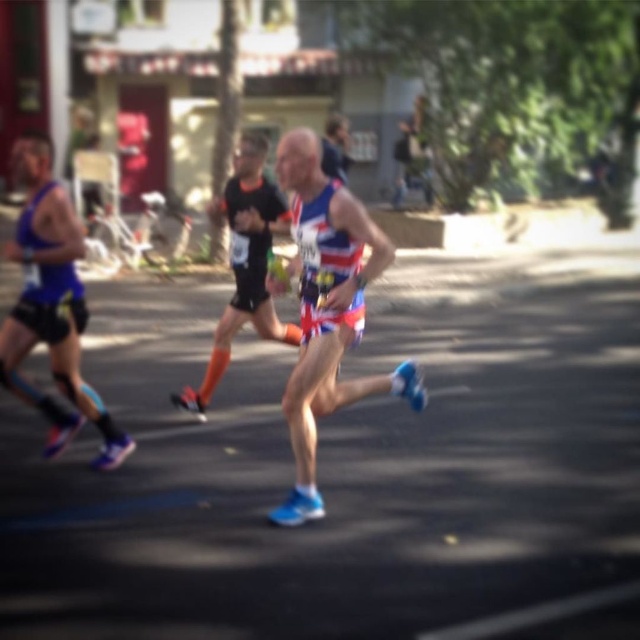
You are a photographer standing at the starting line of the marathon. You want to take a photo that includes both the point at coordinates point (109, 461) and point (241, 182). Which point will appear larger in your photo?

Point (109, 461) is closer to the camera than point (241, 182), so it will appear larger in the photo.

You are a spectator at the marathon and want to take a photo of both the matte blue shorts at center and the reflective blue shorts at center. Which one should you pan your camera to the right to capture first?

The reflective blue shorts at center is on the left side of the matte blue shorts at center, so you should pan your camera to the right to first capture the matte blue shorts at center.

You are a photographer positioned at the starting line of the marathon. You want to capture a photo that includes both the matte blue shorts at center and the matte blue tank top at left. Given that your camera has a maximum focus range of 6 feet, will you be able to include both in the same frame without moving your position?

The matte blue shorts at center is 6.33 feet away from the matte blue tank top at left. Since the distance between them exceeds the camera maximum focus range of 6 feet, you won that be able to include both in the same frame without moving your position.